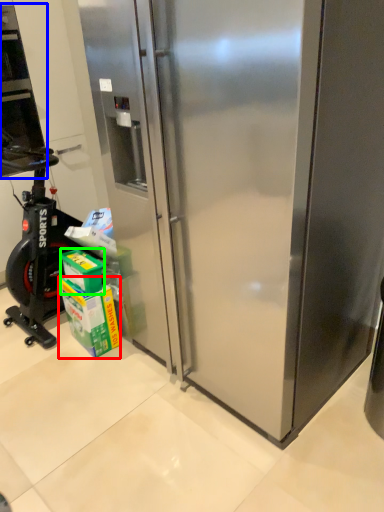
Question: Which object is positioned closest to carton (highlighted by a red box)? Select from home appliance (highlighted by a blue box) and box (highlighted by a green box).

Choices:
 (A) home appliance
 (B) box

Answer: (B)